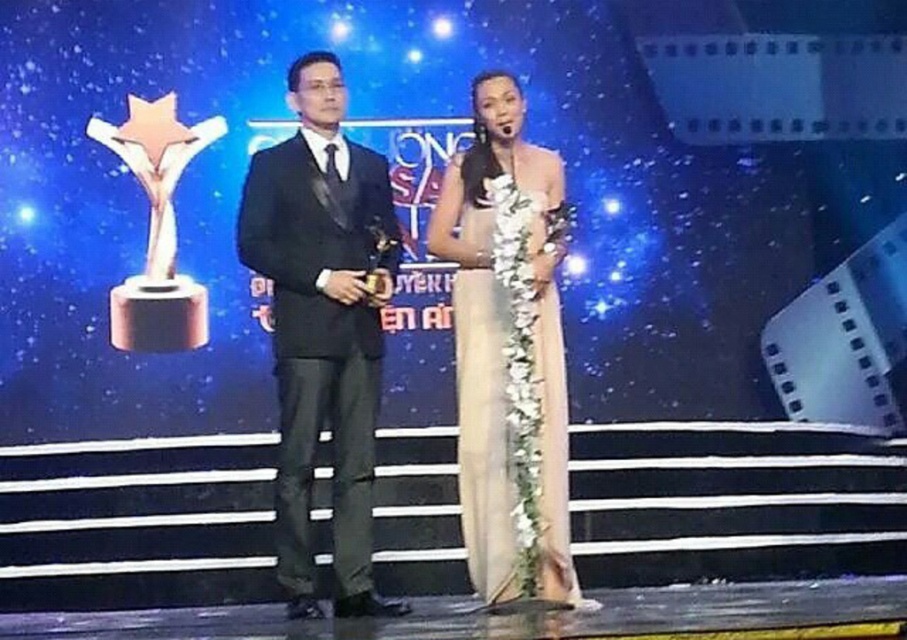
You are a photographer at the event and need to position a spotlight on the black satin suit at center and the satin beige dress at center. Since the spotlight can only illuminate one side, which side should you choose to ensure both are lit properly?

You should position the spotlight on the left side because the black satin suit at center is to the left of the satin beige dress at center, so lighting from the left will cover both.

You are a photographer at the event and need to adjust the lighting to ensure both the black satin suit at center and the satin beige dress at center are equally highlighted. Considering their sizes, which one might require more focused lighting to appear balanced in the photo?

The black satin suit at center has a larger size compared to the satin beige dress at center, so it would require less focused lighting to appear balanced since its larger size naturally draws more attention.

You are a photographer at the event and need to adjust the lighting so that both the black satin suit at center and the satin beige dress at center are equally illuminated. Considering their heights, which one might require a higher light source adjustment?

The black satin suit at center is much taller than the satin beige dress at center, so the light source adjustment should be higher for the black satin suit at center to ensure proper illumination.